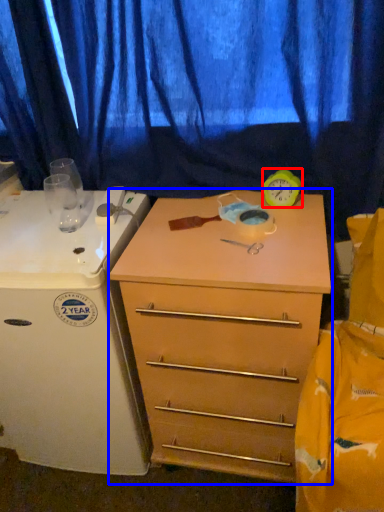
Question: Which object is closer to the camera taking this photo, clock (highlighted by a red box) or chest of drawers (highlighted by a blue box)?

Choices:
 (A) clock
 (B) chest of drawers

Answer: (B)